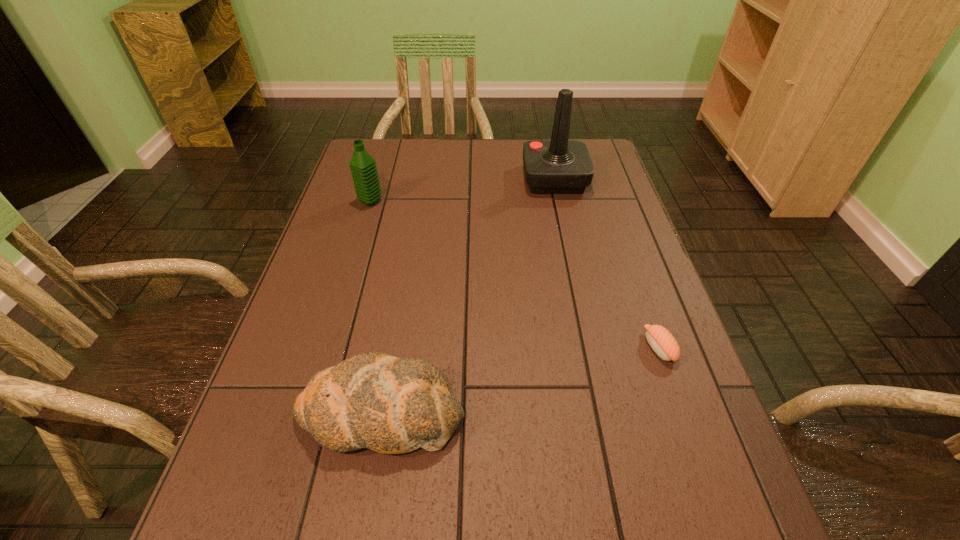
What are the coordinates of `joystick` in the screenshot? It's located at (557, 166).

The width and height of the screenshot is (960, 540). In order to click on the third object from left to right in this screenshot , I will do `click(557, 166)`.

Identify the location of water bottle. The width and height of the screenshot is (960, 540). (363, 167).

Find the location of a particular element. bread is located at coordinates (391, 405).

Locate an element on the screen. The image size is (960, 540). the nearest object is located at coordinates (391, 405).

Locate an element on the screen. The image size is (960, 540). the second nearest object is located at coordinates (659, 338).

Find the location of a particular element. sushi is located at coordinates (659, 338).

The height and width of the screenshot is (540, 960). I want to click on vacant area situated on the front of the tallest object, so coord(580,296).

This screenshot has height=540, width=960. In order to click on free region located on the right of the second tallest object in this screenshot , I will do `click(444, 202)`.

I want to click on vacant space located on the right of the nearest object, so click(646, 413).